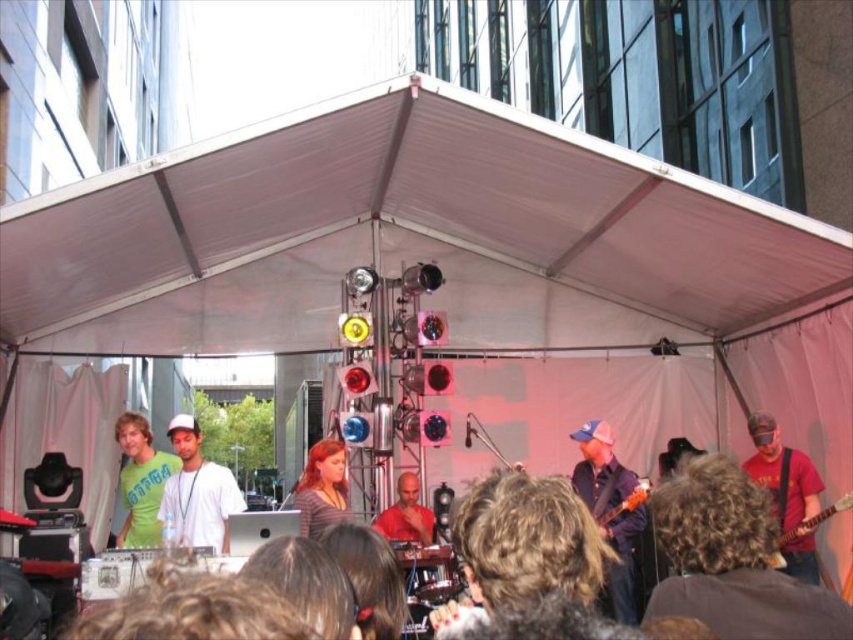
I want to click on white matte shirt at center, so click(196, 492).

Between white matte shirt at center and matte gray shirt at center, which one has more height?

white matte shirt at center

You are a GUI agent. You are given a task and a screenshot of the screen. Output one action in this format:
    pyautogui.click(x=<x>, y=<y>)
    Task: Click on the white matte shirt at center
    The height and width of the screenshot is (640, 853).
    Given the screenshot: What is the action you would take?
    pyautogui.click(x=196, y=492)

Who is positioned more to the left, curly hair at center or matte red guitar at lower right?

curly hair at center is more to the left.

Image resolution: width=853 pixels, height=640 pixels. What do you see at coordinates (523, 552) in the screenshot?
I see `curly hair at center` at bounding box center [523, 552].

Identify the location of curly hair at center. This screenshot has width=853, height=640. (523, 552).

Which is below, matte red guitar at lower right or green matte t-shirt at left?

green matte t-shirt at left is below.

Who is positioned more to the right, matte red guitar at lower right or green matte t-shirt at left?

matte red guitar at lower right

Is point (805, 492) farther from camera compared to point (138, 490)?

No, it is in front of (138, 490).

At what (x,y) coordinates should I click in order to perform the action: click on matte red guitar at lower right. Please return your answer as a coordinate pair (x, y). This screenshot has width=853, height=640. Looking at the image, I should click on (782, 474).